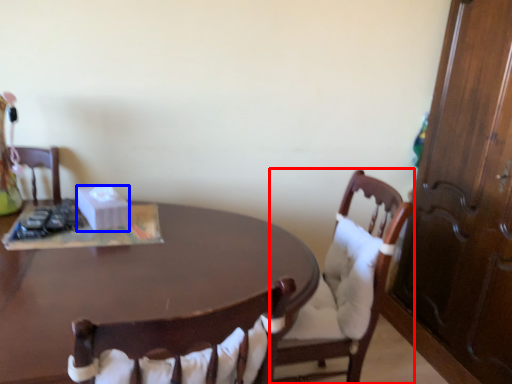
Question: Which of the following is the closest to the observer, chair (highlighted by a red box) or box (highlighted by a blue box)?

Choices:
 (A) chair
 (B) box

Answer: (A)